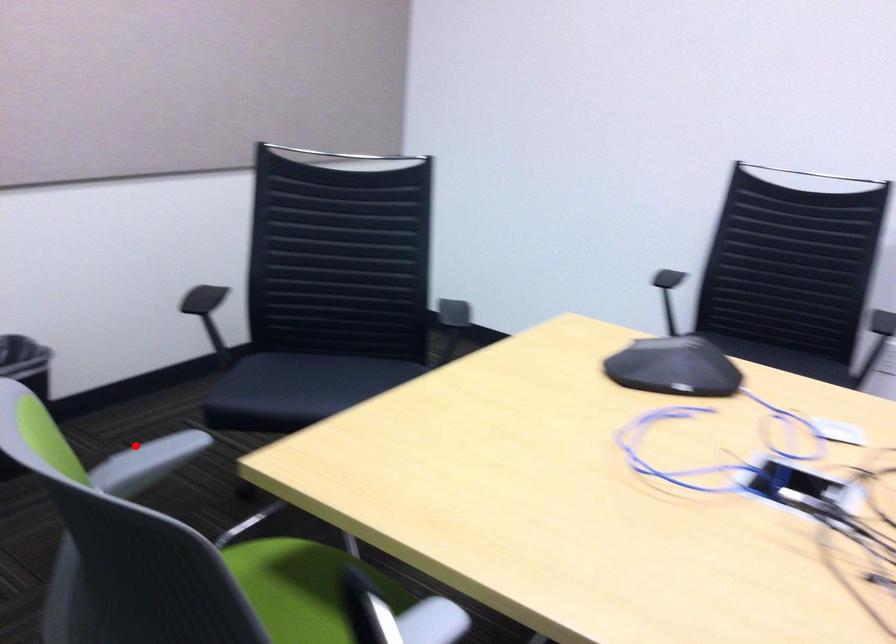
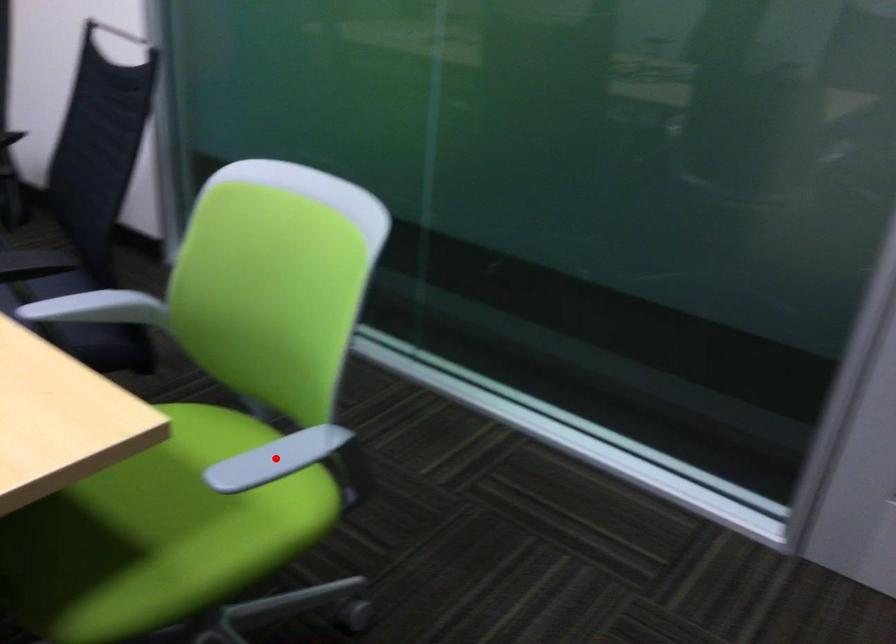
From the picture: I am providing you with two images of the same scene from different viewpoints. A red point is marked on the first image and another point is marked on the second image. Are the points marked in image1 and image2 representing the same 3D position?

Yes